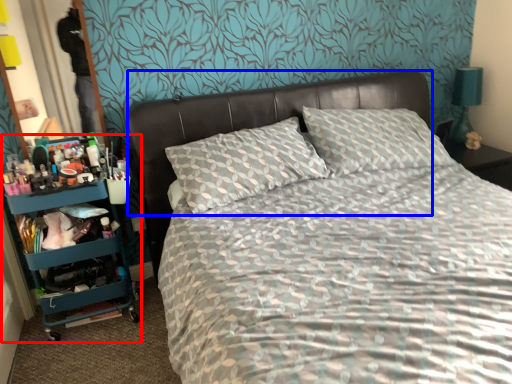
Question: Which of the following is the closest to the observer, bookshelf (highlighted by a red box) or headboard (highlighted by a blue box)?

Choices:
 (A) bookshelf
 (B) headboard

Answer: (B)